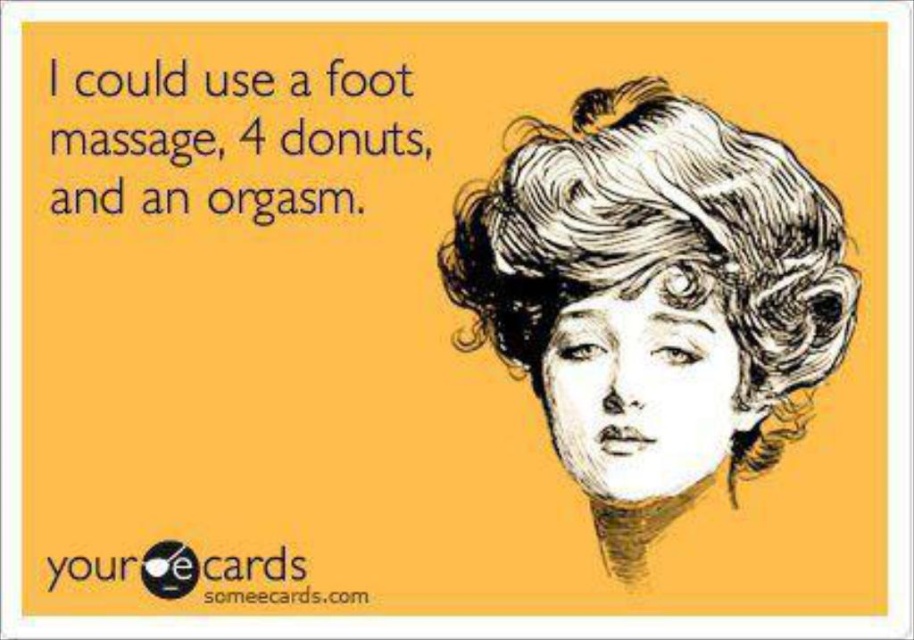
Between white textured hair at upper right and black text at upper left, which one is positioned higher?

black text at upper left

Between white textured hair at upper right and black text at upper left, which one appears on the left side from the viewer's perspective?

From the viewer's perspective, black text at upper left appears more on the left side.

The image size is (914, 640). Describe the element at coordinates (662, 246) in the screenshot. I see `white textured hair at upper right` at that location.

The height and width of the screenshot is (640, 914). In order to click on white textured hair at upper right in this screenshot , I will do `click(662, 246)`.

Is the position of white textured hair at upper right less distant than that of black logo at upper center?

Yes.

Does point (524, 257) come farther from viewer compared to point (155, 560)?

No, it is in front of (155, 560).

The image size is (914, 640). Describe the element at coordinates (662, 246) in the screenshot. I see `white textured hair at upper right` at that location.

Locate an element on the screen. The height and width of the screenshot is (640, 914). white textured hair at upper right is located at coordinates (662, 246).

Can you confirm if black text at upper left is smaller than black logo at upper center?

No, black text at upper left is not smaller than black logo at upper center.

Find the location of a particular element. black text at upper left is located at coordinates [x=137, y=141].

Where is `black text at upper left`? The image size is (914, 640). black text at upper left is located at coordinates [137, 141].

The width and height of the screenshot is (914, 640). I want to click on black text at upper left, so click(x=137, y=141).